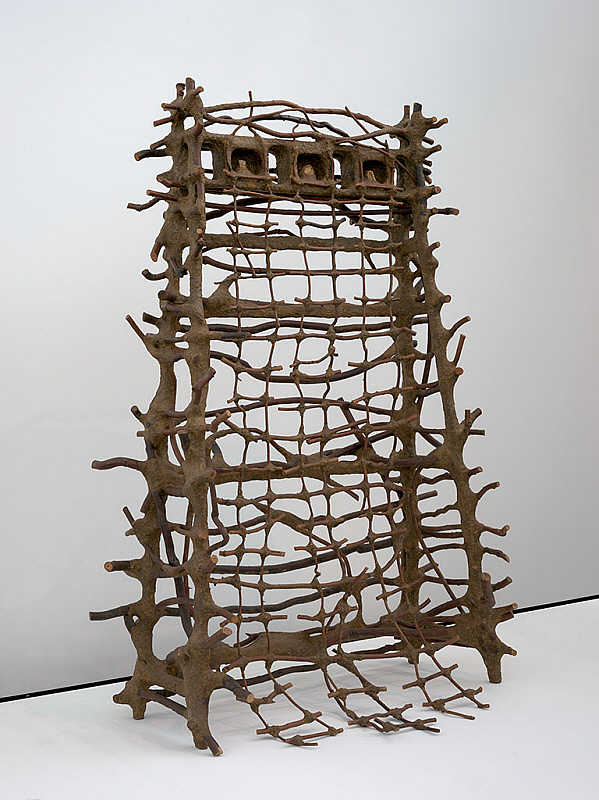
Locate an element on the screen. wall is located at coordinates [x=56, y=502].